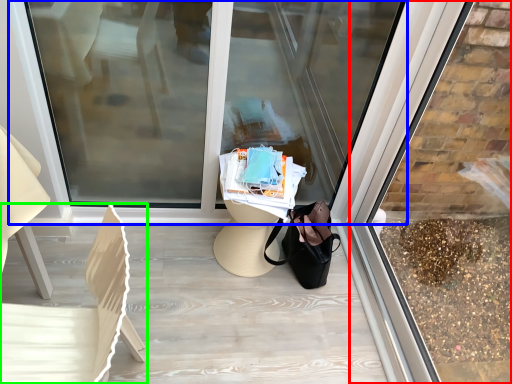
Question: Which object is the farthest from shop window (highlighted by a red box)? Choose among these: shop window (highlighted by a blue box) or chair (highlighted by a green box).

Choices:
 (A) shop window
 (B) chair

Answer: (B)